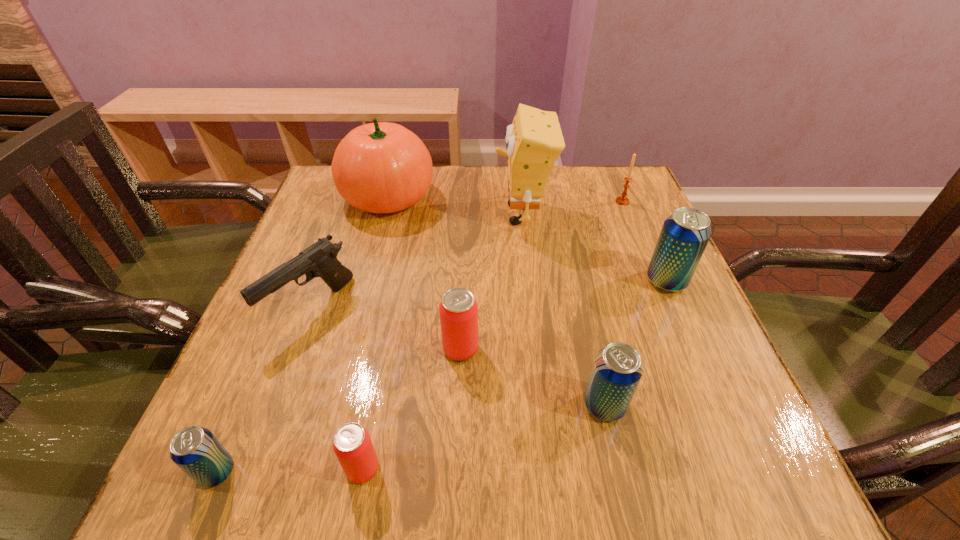
The height and width of the screenshot is (540, 960). What are the coordinates of `beer can that is at the left edge` in the screenshot? It's located at click(195, 450).

Identify the location of beer can at the right edge. (685, 234).

Locate an element on the screen. candle_holder that is at the right edge is located at coordinates (622, 200).

This screenshot has width=960, height=540. What are the coordinates of `object located at the far left corner` in the screenshot? It's located at (381, 167).

Identify the location of object that is at the near left corner. The image size is (960, 540). (195, 450).

Where is `object positioned at the far right corner`? The width and height of the screenshot is (960, 540). object positioned at the far right corner is located at coordinates (622, 200).

The image size is (960, 540). Identify the location of free spot at the far edge of the desktop. (571, 167).

This screenshot has height=540, width=960. I want to click on free space at the near edge of the desktop, so click(x=643, y=483).

At what (x,y) coordinates should I click in order to perform the action: click on free space at the left edge of the desktop. Please return your answer as a coordinate pair (x, y). This screenshot has width=960, height=540. Looking at the image, I should click on (268, 333).

Where is `vacant space at the right edge`? This screenshot has height=540, width=960. vacant space at the right edge is located at coordinates (630, 234).